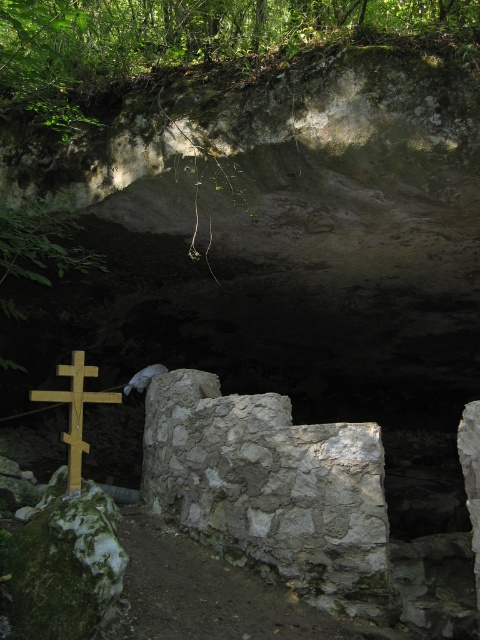
You are a hiker navigating through the forest and want to reach the wooden cross at left to leave a marker. Which object do you need to pass first as you approach the gray stone wall at center?

You will reach the wooden cross at left first because it is closer to you than the gray stone wall at center, which is further away.

In the scene shown: You are standing at the entrance of the cave and want to place a small offering on the gray stone wall at center. Based on its position, can you determine if the wall is directly in front of you or to one side?

The gray stone wall at center is located at point [271,486], which places it directly in front of you since it is at the center of the scene.